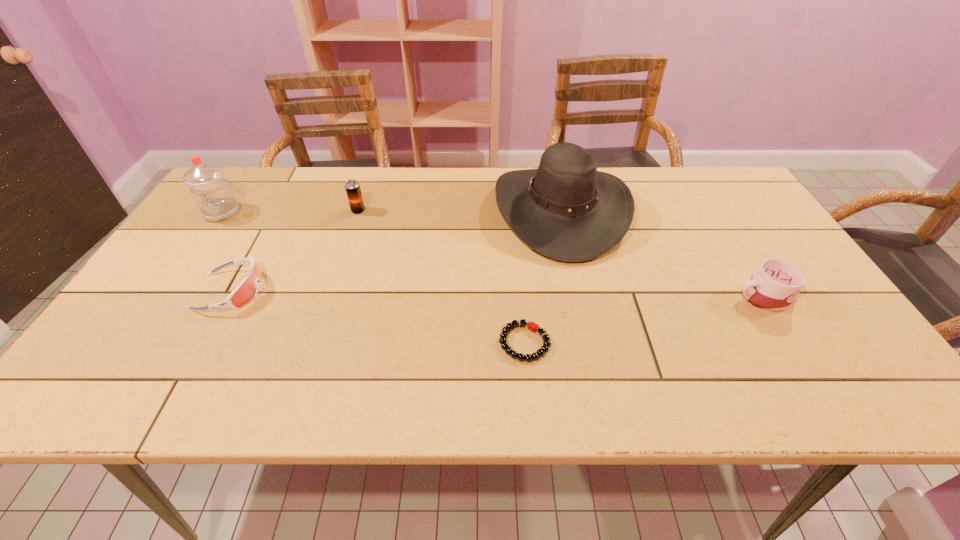
Image resolution: width=960 pixels, height=540 pixels. Find the location of `free space located on the handle side of the water bottle`. free space located on the handle side of the water bottle is located at coordinates (179, 274).

Where is `free region located 0.400m on the front-facing side of the cowboy hat`? The width and height of the screenshot is (960, 540). free region located 0.400m on the front-facing side of the cowboy hat is located at coordinates (359, 211).

The height and width of the screenshot is (540, 960). Identify the location of free space located 0.330m on the front-facing side of the cowboy hat. (383, 211).

You are a GUI agent. You are given a task and a screenshot of the screen. Output one action in this format:
    pyautogui.click(x=<x>, y=<y>)
    Task: Click on the free location located 0.050m on the front-facing side of the cowboy hat
    
    Given the screenshot: What is the action you would take?
    pyautogui.click(x=478, y=211)

The width and height of the screenshot is (960, 540). I want to click on free space located on the left of the beer can, so click(x=250, y=211).

Identify the location of vacant space located 0.310m on the side with the handle of the mug. pyautogui.click(x=606, y=296).

Locate an element on the screen. blank space located 0.380m on the side with the handle of the mug is located at coordinates (577, 296).

This screenshot has width=960, height=540. I want to click on free space located on the side with the handle of the mug, so click(581, 296).

Where is `blank space located on the front-facing side of the goggles`? The width and height of the screenshot is (960, 540). blank space located on the front-facing side of the goggles is located at coordinates (395, 291).

Identify the location of free space located 0.150m on the right of the nearest object. (619, 342).